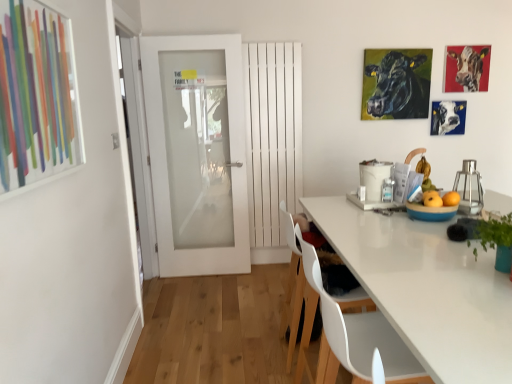
Question: Considering the positions of point (406, 62) and point (432, 218), is point (406, 62) closer or farther from the camera than point (432, 218)?

Choices:
 (A) closer
 (B) farther

Answer: (B)

Question: From a real-world perspective, is black glossy cattle at upper right, the 3th cattle positioned from the right, positioned above or below blue glossy bowl at right?

Choices:
 (A) above
 (B) below

Answer: (A)

Question: Estimate the real-world distances between objects in this image. Which object is closer to the white matte radiator at center, acting as the first door starting from the right?

Choices:
 (A) painted cow at upper right, the 3th cattle when ordered from left to right
 (B) green glossy plant at right
 (C) yellow matte apple at right
 (D) black glossy cattle at upper right, the 3th cattle positioned from the right
 (E) white plastic chair at lower center, which is the first chair from front to back

Answer: (D)

Question: Considering the real-world distances, which object is farthest from the black glossy cattle at upper right, the 1th cattle from the left?

Choices:
 (A) yellow matte apple at right
 (B) painted cow at upper right, the 3th cattle when ordered from left to right
 (C) blue glossy cow at upper right, placed as the second cattle when sorted from right to left
 (D) blue glossy bowl at right
 (E) metallic glass container at right

Answer: (D)